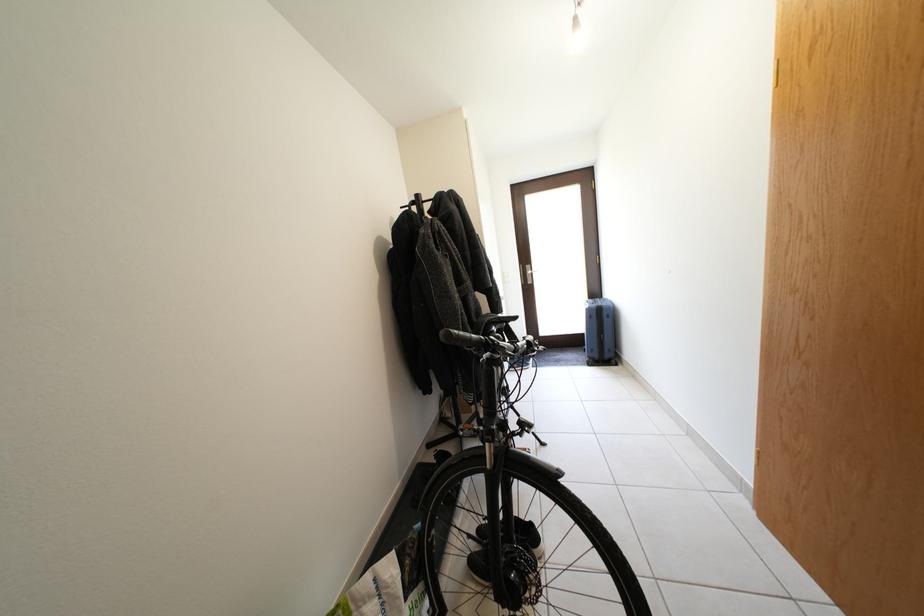
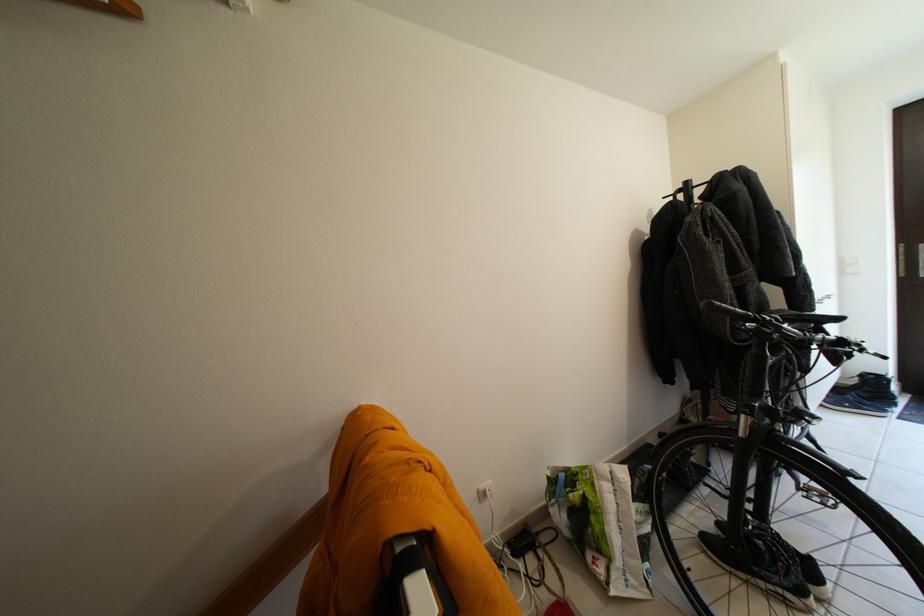
In the second image, find the point that corresponds to (x=427, y=201) in the first image.

(696, 188)